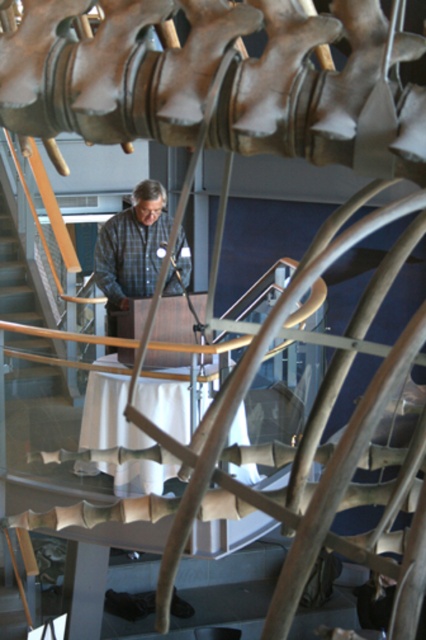
You are an attendee at a conference and see the plaid shirt at center and the wooden at left in the image. Which object is positioned to the left of the other?

The plaid shirt at center is to the right of wooden at left, so the wooden at left is positioned to the left of the plaid shirt at center.

You are an event planner assessing the layout of this indoor space. You need to ensure there is enough vertical clearance for a 1.8m tall banner. The banner will be placed between the plaid shirt at center and the wooden at left. Based on the height of these two objects, can the banner fit vertically between them?

The plaid shirt at center is shorter than the wooden at left. Since the banner requires 1.8m of vertical space, the minimum height between them must be at least 1.8m. However, without knowing the exact heights of both objects, we cannot confirm if the vertical clearance is sufficient. The answer depends on the actual heights of the plaid shirt at center and wooden at left.

You are an event organizer setting up a stage. You have a plaid shirt at center and a wooden at left. Which one is wider?

The wooden at left is wider than the plaid shirt at center.